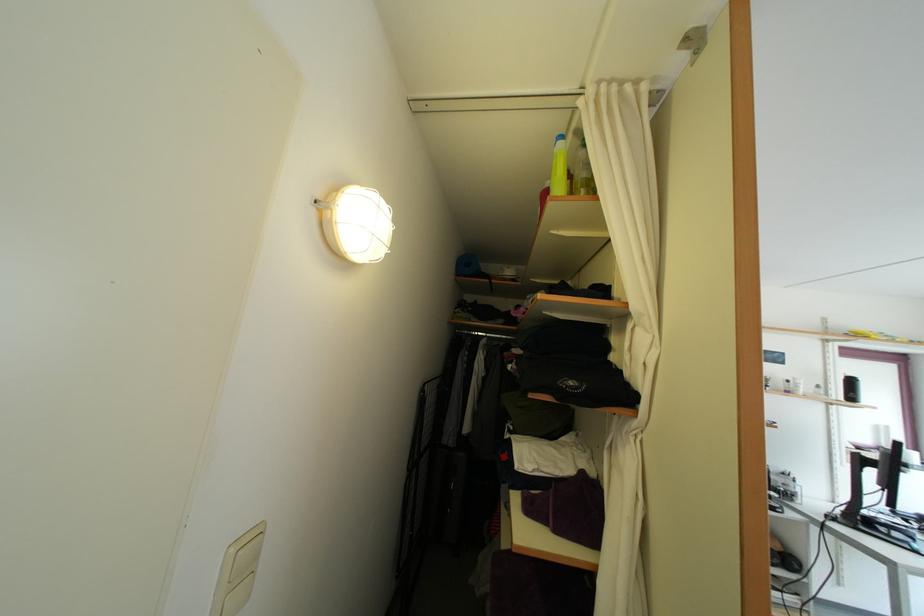
I want to click on blue rolled-up mat, so click(467, 265).